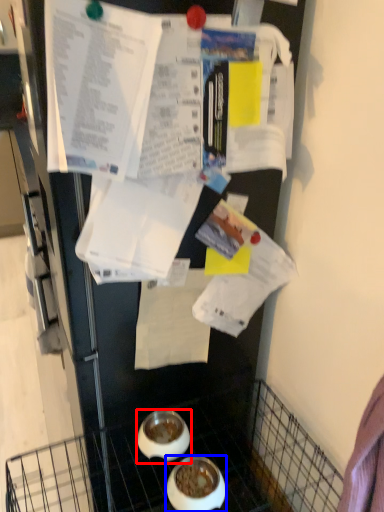
Question: Among these objects, which one is farthest to the camera, bowl (highlighted by a red box) or bowl (highlighted by a blue box)?

Choices:
 (A) bowl
 (B) bowl

Answer: (A)